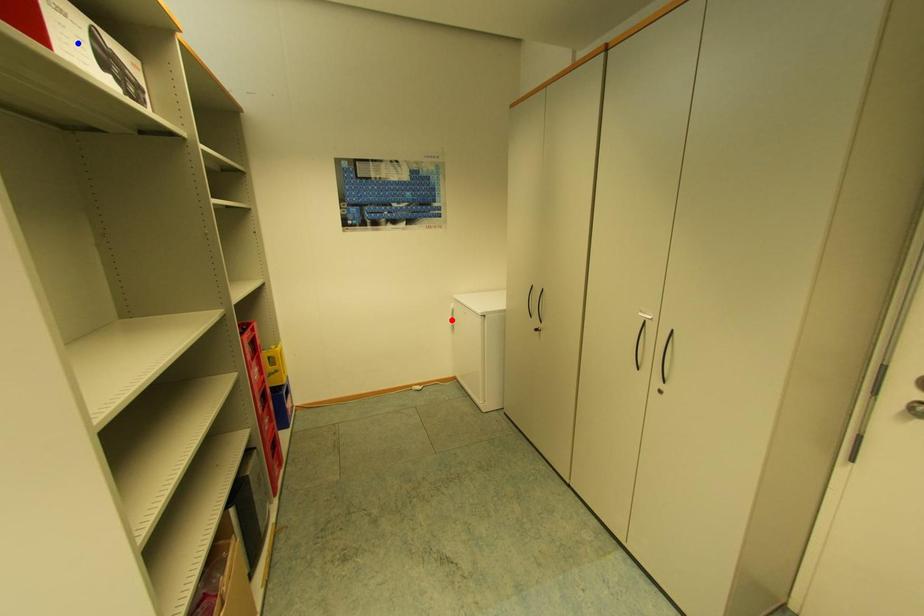
Question: Which of the two points in the image is closer to the camera?

Choices:
 (A) Blue point is closer.
 (B) Red point is closer.

Answer: (A)